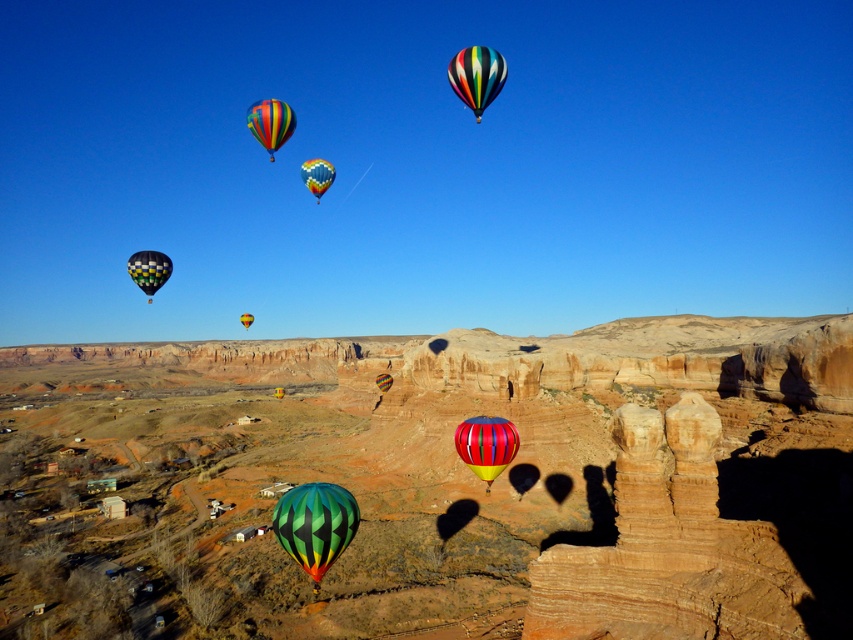
Can you confirm if green striped balloon at center is positioned below multicolored fabric hot air balloon at left?

Yes.

Is the position of green striped balloon at center more distant than that of multicolored fabric hot air balloon at left?

That is False.

Does point (331, 516) come farther from viewer compared to point (164, 276)?

No, (331, 516) is in front of (164, 276).

This screenshot has width=853, height=640. Identify the location of green striped balloon at center. (315, 524).

Can you confirm if rainbow striped hot air balloon at upper center is thinner than multicolored fabric hot air balloon at upper center?

Yes, rainbow striped hot air balloon at upper center is thinner than multicolored fabric hot air balloon at upper center.

Which is in front, point (473, 100) or point (245, 323)?

Point (473, 100)

This screenshot has height=640, width=853. Identify the location of rainbow striped hot air balloon at upper center. (476, 76).

The image size is (853, 640). Identify the location of rainbow striped hot air balloon at upper center. (476, 76).

How far apart are green striped balloon at center and multicolored fabric hot air balloon at center?

The distance of green striped balloon at center from multicolored fabric hot air balloon at center is 83.32 meters.

Can you confirm if green striped balloon at center is taller than multicolored fabric hot air balloon at center?

Correct, green striped balloon at center is much taller as multicolored fabric hot air balloon at center.

Identify the location of green striped balloon at center. (315, 524).